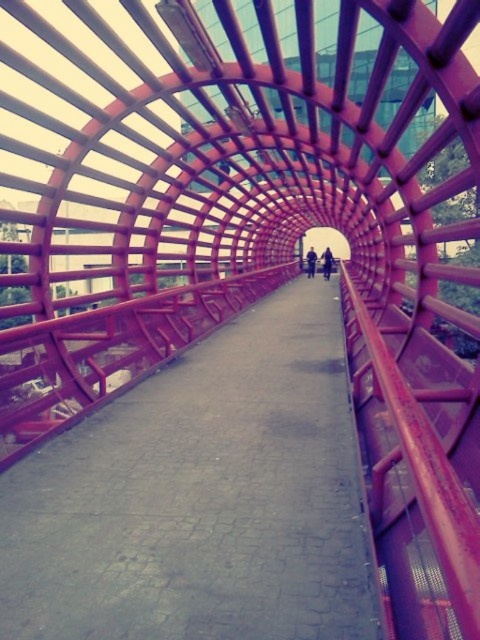
You are standing in the middle of the pink tunnel and see both the dark blue jeans at center and the dark blue jacket at center. Which one is positioned to the right side from your perspective?

The dark blue jeans at center is positioned to the right of the dark blue jacket at center, so the dark blue jeans at center is on the right side.

You are a delivery person carrying a large box that is 2 meters wide. You need to walk through the tunnel shown in the image. Can you safely pass through the metallic pink walkway at center without hitting the sides?

The metallic pink walkway at center is 2.20 meters from the camera. Since the box is 2 meters wide, which is narrower than the walkway, you can safely pass through without hitting the sides.

You are standing at the entrance of the pink tunnel and see a person wearing dark blue jeans at center and a dark blue jacket at center. If you want to reach the person, which direction should you walk towards? The person is facing away from you.

Since the dark blue jeans at center is 11.84 feet from the dark blue jacket at center, you should walk towards the dark blue jacket at center because the jeans are part of the person, and the jacket is the upper body clothing. However, the description does not specify the direction of the jacket relative to the jeans. Wait, this might be incorrect. Let me recheck the rules. The objects are dark blue jeans and dark blue jacket both at center. The description says the jeans are 11.84 feet from the jacket. Hmm